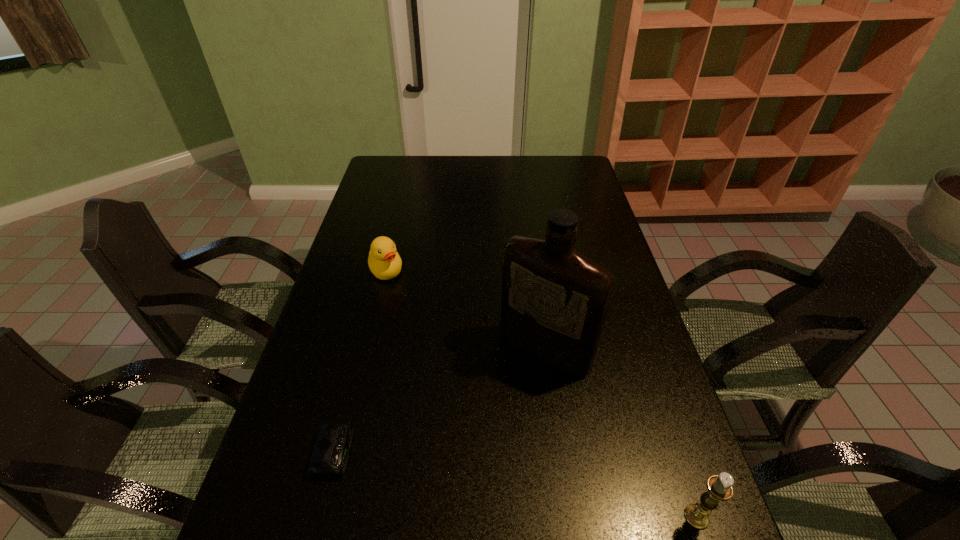
I want to click on alarm clock, so click(329, 457).

Where is `the shortest object`? This screenshot has width=960, height=540. the shortest object is located at coordinates (329, 457).

Locate an element on the screen. The width and height of the screenshot is (960, 540). the rightmost object is located at coordinates (719, 487).

Identify the location of the nearest object. The image size is (960, 540). (719, 487).

The height and width of the screenshot is (540, 960). I want to click on the second shortest object, so click(384, 261).

Locate an element on the screen. the farthest object is located at coordinates (384, 261).

The image size is (960, 540). Find the location of `liquor`. liquor is located at coordinates (554, 303).

Where is `the third nearest object`? This screenshot has height=540, width=960. the third nearest object is located at coordinates (554, 303).

Find the location of a particular element. This screenshot has height=540, width=960. free spot located 0.080m on the display of the shortest object is located at coordinates (387, 451).

This screenshot has height=540, width=960. In order to click on free point located 0.110m on the left of the rightmost object in this screenshot , I will do `click(628, 517)`.